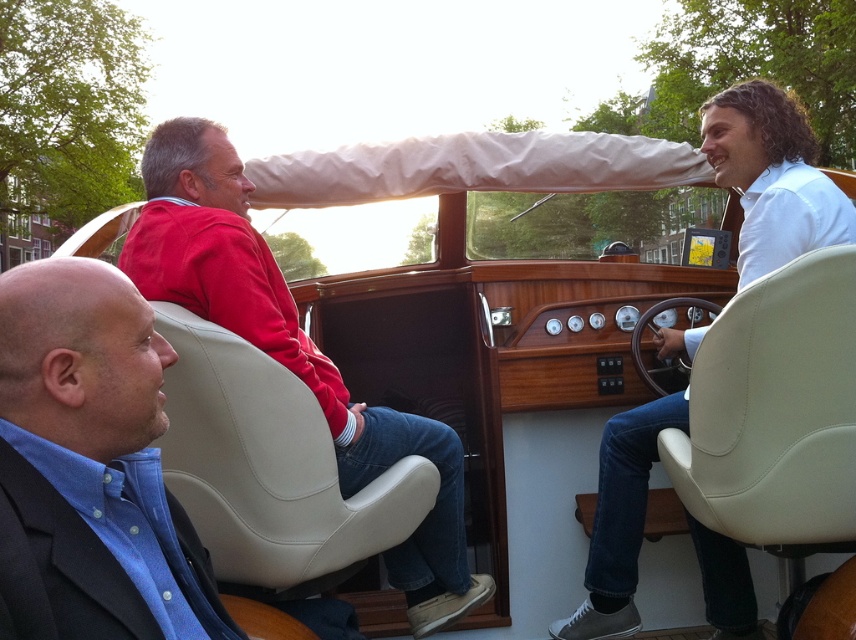
Question: Considering the real-world distances, which object is farthest from the white matte shirt at center?

Choices:
 (A) blue cotton shirt at left
 (B) matte red sweater at center

Answer: (A)

Question: Where is matte red sweater at center located in relation to white matte shirt at center in the image?

Choices:
 (A) above
 (B) below

Answer: (B)

Question: Can you confirm if blue cotton shirt at left is wider than matte red sweater at center?

Choices:
 (A) no
 (B) yes

Answer: (A)

Question: From the image, what is the correct spatial relationship of blue cotton shirt at left in relation to white matte shirt at center?

Choices:
 (A) above
 (B) below

Answer: (B)

Question: Which object is closer to the camera taking this photo?

Choices:
 (A) white matte shirt at center
 (B) blue cotton shirt at left

Answer: (B)

Question: Which of the following is the closest to the observer?

Choices:
 (A) matte red sweater at center
 (B) blue cotton shirt at left
 (C) white matte shirt at center

Answer: (B)